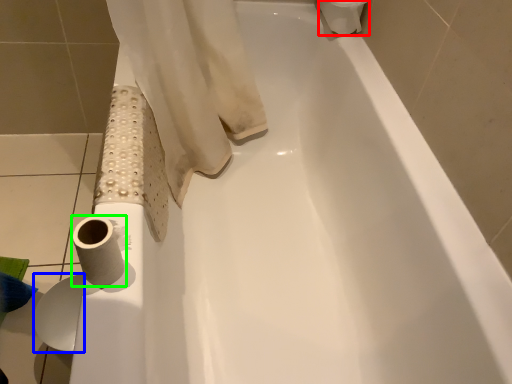
Question: Considering the real-world distances, which object is farthest from toilet paper (highlighted by a red box)? toilet paper (highlighted by a blue box) or toilet paper (highlighted by a green box)?

Choices:
 (A) toilet paper
 (B) toilet paper

Answer: (A)